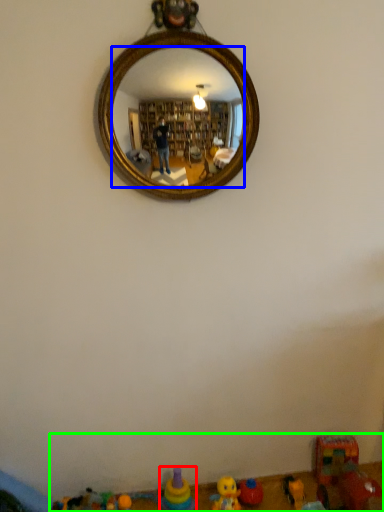
Question: Considering the real-world distances, which object is farthest from toy (highlighted by a red box)? mirror (highlighted by a blue box) or toy (highlighted by a green box)?

Choices:
 (A) mirror
 (B) toy

Answer: (A)